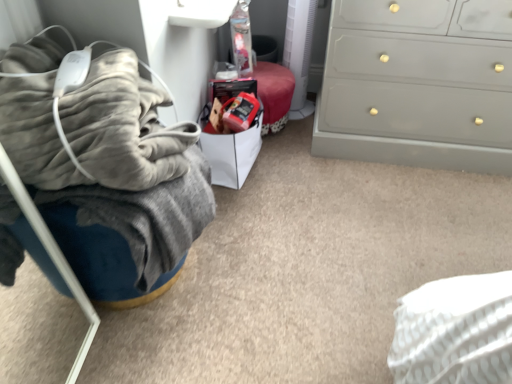
Question: Does matte gray dresser at right have a smaller size compared to white paper bag at center?

Choices:
 (A) yes
 (B) no

Answer: (B)

Question: Does matte gray dresser at right lie in front of white paper bag at center?

Choices:
 (A) no
 (B) yes

Answer: (B)

Question: Is matte gray dresser at right at the right side of white paper bag at center?

Choices:
 (A) yes
 (B) no

Answer: (A)

Question: Is matte gray dresser at right completely or partially outside of white paper bag at center?

Choices:
 (A) no
 (B) yes

Answer: (B)

Question: Is white paper bag at center a part of matte gray dresser at right?

Choices:
 (A) yes
 (B) no

Answer: (B)

Question: Does matte gray dresser at right have a larger size compared to white paper bag at center?

Choices:
 (A) no
 (B) yes

Answer: (B)

Question: Could you tell me if white paper bag at center is turned towards matte gray dresser at right?

Choices:
 (A) yes
 (B) no

Answer: (A)

Question: Considering the relative sizes of white paper bag at center and matte gray dresser at right in the image provided, is white paper bag at center taller than matte gray dresser at right?

Choices:
 (A) no
 (B) yes

Answer: (A)

Question: Is white paper bag at center to the left of matte gray dresser at right from the viewer's perspective?

Choices:
 (A) no
 (B) yes

Answer: (B)

Question: Can we say white paper bag at center lies outside matte gray dresser at right?

Choices:
 (A) yes
 (B) no

Answer: (A)

Question: Is white paper bag at center positioned far away from matte gray dresser at right?

Choices:
 (A) yes
 (B) no

Answer: (B)

Question: Does white paper bag at center have a lesser width compared to matte gray dresser at right?

Choices:
 (A) yes
 (B) no

Answer: (A)

Question: Does white paper bag at center have a greater width compared to velvety gray blanket at left?

Choices:
 (A) yes
 (B) no

Answer: (B)